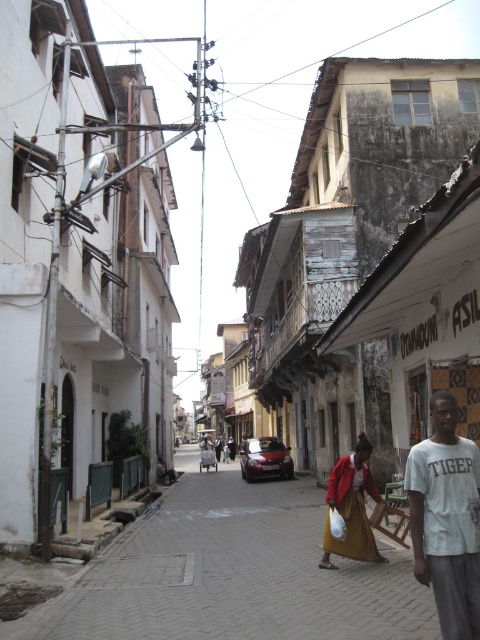
Question: Which point is farther to the camera?

Choices:
 (A) (363, 545)
 (B) (441, 500)

Answer: (A)

Question: Is brick paved street at center further to the viewer compared to white cotton t-shirt at lower right?

Choices:
 (A) yes
 (B) no

Answer: (A)

Question: Can you confirm if brick paved street at center is positioned below white cotton t-shirt at lower right?

Choices:
 (A) yes
 (B) no

Answer: (A)

Question: Which point is closer to the camera?

Choices:
 (A) white cotton t-shirt at lower right
 (B) brick paved street at center

Answer: (A)

Question: Considering the real-world distances, which object is farthest from the brick paved street at center?

Choices:
 (A) red fabric skirt at lower center
 (B) white cotton t-shirt at lower right

Answer: (A)

Question: Is white cotton t-shirt at lower right thinner than red fabric skirt at lower center?

Choices:
 (A) yes
 (B) no

Answer: (A)